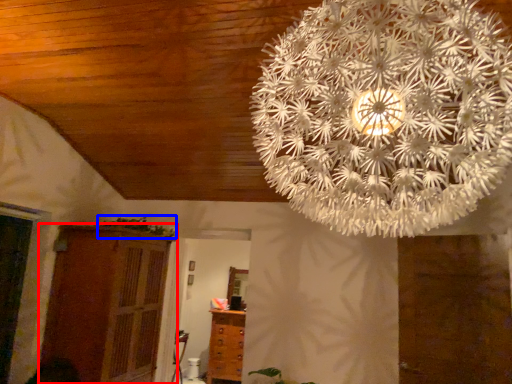
Question: Which point is closer to the camera, cupboard (highlighted by a red box) or plant (highlighted by a blue box)?

Choices:
 (A) cupboard
 (B) plant

Answer: (A)